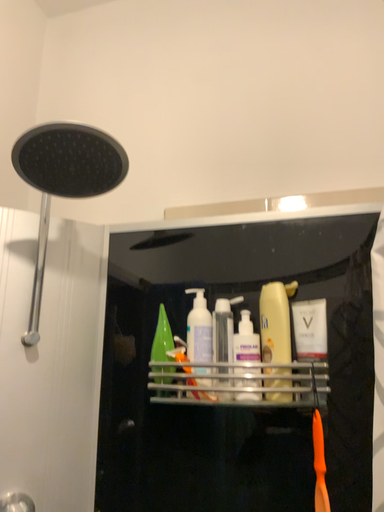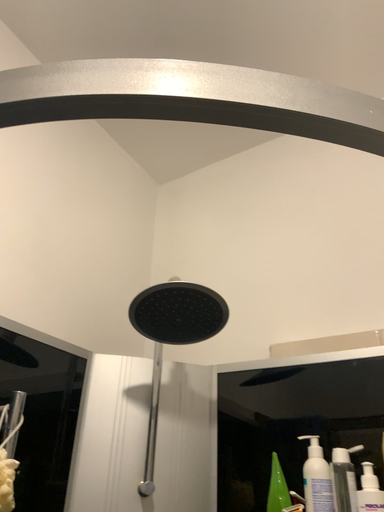
Question: How did the camera likely rotate when shooting the video?

Choices:
 (A) rotated downward
 (B) rotated upward

Answer: (B)